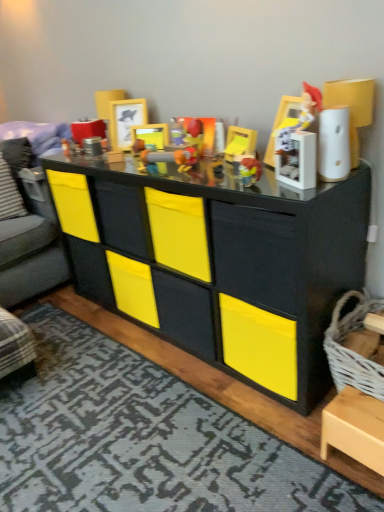
Locate an element on the screen. This screenshot has height=512, width=384. vacant space that is to the left of light wood cabinet at lower right is located at coordinates (306, 466).